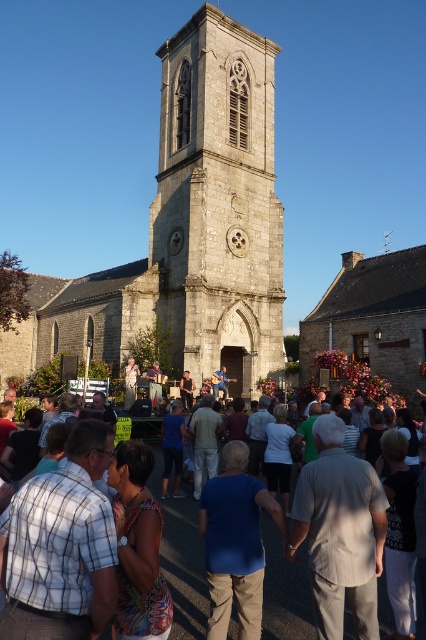
Question: Can you confirm if stone church at center is smaller than stone bell tower at center?

Choices:
 (A) no
 (B) yes

Answer: (A)

Question: Which point is farther from the camera taking this photo?

Choices:
 (A) (186, 570)
 (B) (259, 250)

Answer: (B)

Question: Among these objects, which one is nearest to the camera?

Choices:
 (A) stone church at center
 (B) stone bell tower at center
 (C) white cotton crowd at center

Answer: (C)

Question: Can you confirm if stone church at center is positioned above white cotton crowd at center?

Choices:
 (A) yes
 (B) no

Answer: (A)

Question: From the image, what is the correct spatial relationship of stone church at center in relation to stone bell tower at center?

Choices:
 (A) below
 (B) above

Answer: (A)

Question: Estimate the real-world distances between objects in this image. Which object is farther from the stone church at center?

Choices:
 (A) stone bell tower at center
 (B) white cotton crowd at center

Answer: (B)